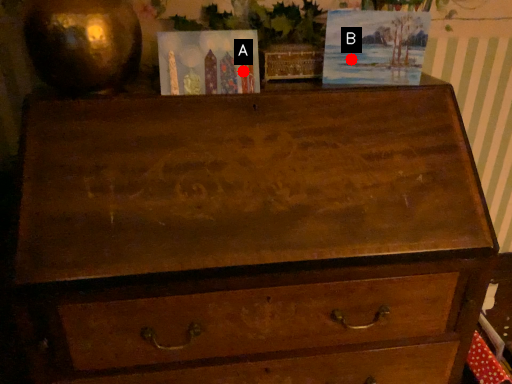
Question: Two points are circled on the image, labeled by A and B beside each circle. Which point is further to the camera?

Choices:
 (A) A is further
 (B) B is further

Answer: (B)